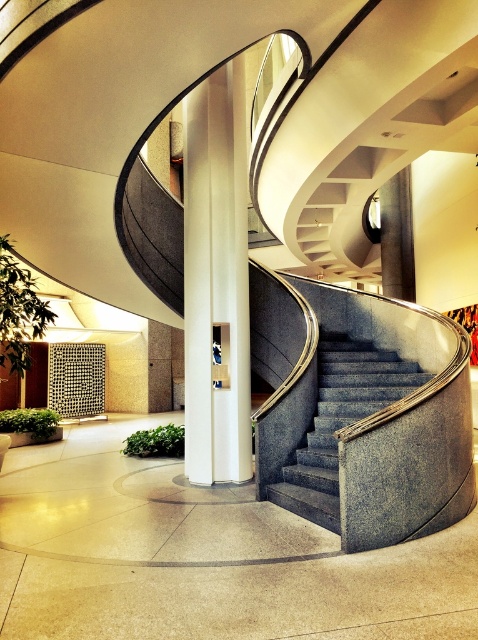
You are an interior designer planning to install a new lighting fixture above the granite gray stairs at center. The fixture requires a clear space of at least 1 meter in front of the stairs. Given the position of the white glossy pillar at center, is there enough space to install the lighting fixture in front of the stairs?

The white glossy pillar at center is behind the granite gray stairs at center, so there is sufficient space in front of the stairs to install the lighting fixture as required.

You are standing in the atrium looking at the spiral staircase. There are two points marked on the staircase, one at coordinates point (x=239, y=378) and the other at point (x=329, y=342). Which point is closer to you?

Point (x=239, y=378) is closer to the viewer than point (x=329, y=342).